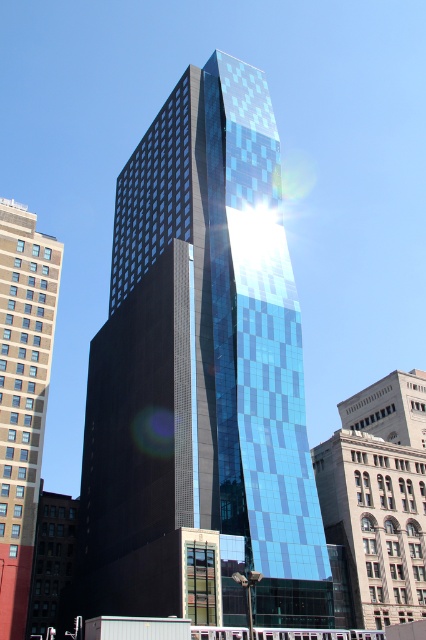
You are standing at the point marked by point [379,497] on the image. Looking around, you see the blue glass skyscraper at center. What is the color of the building you are facing?

The point [379,497] marks the blue glass skyscraper at center, so the building you are facing is blue.

You are standing on the sidewalk in front of the shiny glass skyscraper at center and the beige concrete building at left. Which building would appear larger to someone standing directly in front of them?

The shiny glass skyscraper at center would appear larger because it is closer to the viewer than the beige concrete building at left.

You are a drone operator planning to fly a drone between the blue glass skyscraper at center and the beige concrete building at left. The drone has a maximum flight distance of 40 meters. Can you safely fly the drone between them without exceeding its range?

The distance between the blue glass skyscraper at center and the beige concrete building at left is 39.66 meters, which is within the drone operator maximum flight distance of 40 meters. Therefore, the drone can safely fly between them without exceeding its range.